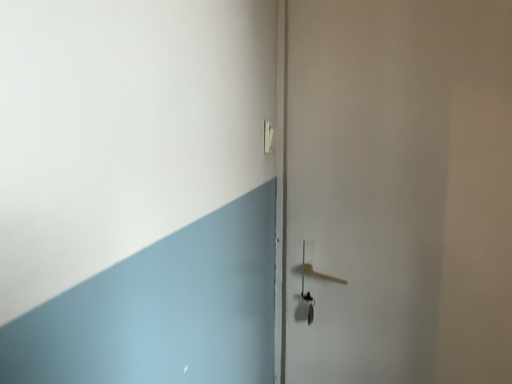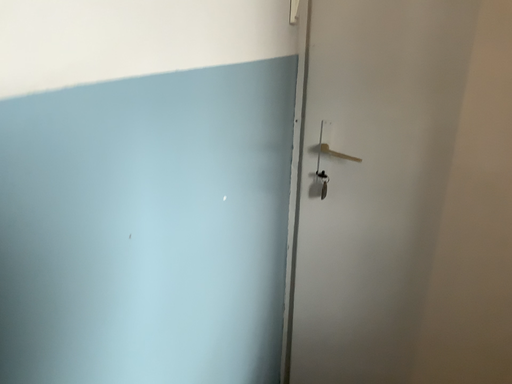
Question: Which way did the camera rotate in the video?

Choices:
 (A) rotated upward
 (B) rotated downward

Answer: (B)